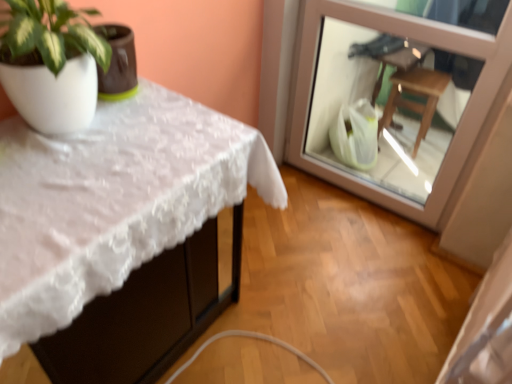
This screenshot has width=512, height=384. Find the location of `empty space that is ontop of white lace tablecloth at upper left (from a real-world perspective)`. empty space that is ontop of white lace tablecloth at upper left (from a real-world perspective) is located at coordinates (103, 146).